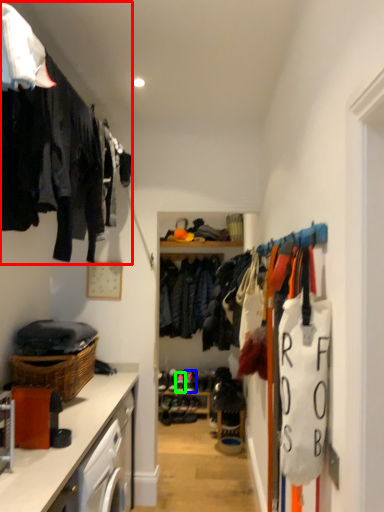
Question: Which object is positioned farthest from closet (highlighted by a red box)? Select from shoe (highlighted by a blue box) and shoe (highlighted by a green box).

Choices:
 (A) shoe
 (B) shoe

Answer: (B)